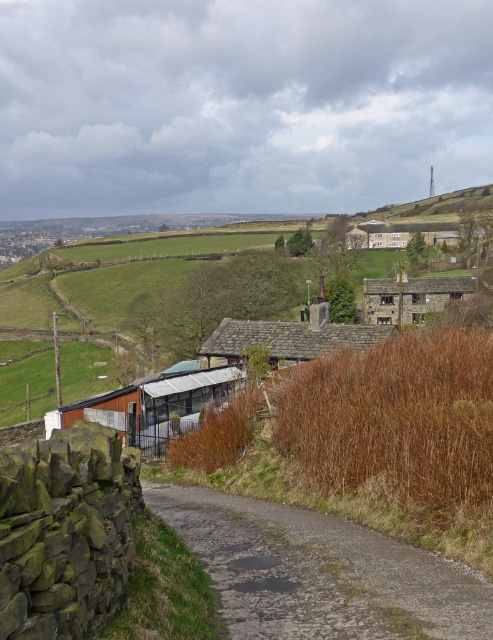
You are driving a delivery truck that is 2 meters wide. You need to pass through the gray asphalt road at center and the brown corrugated metal hut at lower center. Which path can accommodate your truck?

The brown corrugated metal hut at lower center is wider than the gray asphalt road at center, so the truck can pass through the brown corrugated metal hut at lower center but not the gray asphalt road at center.

You are a delivery person trying to locate the brown corrugated metal hut at lower center. From your current position at the gray asphalt road at center, which direction should you move to reach the hut?

Since the gray asphalt road at center is to the right of the brown corrugated metal hut at lower center, you should move to the left to reach the hut.

You are a drone operator trying to capture aerial footage of the gray asphalt road at center. According to the coordinates provided, where should you position your drone to ensure the road is centered in the frame?

Answer: The gray asphalt road at center is located at coordinates point [318,572], so positioning the drone at this point will center the road in the frame.